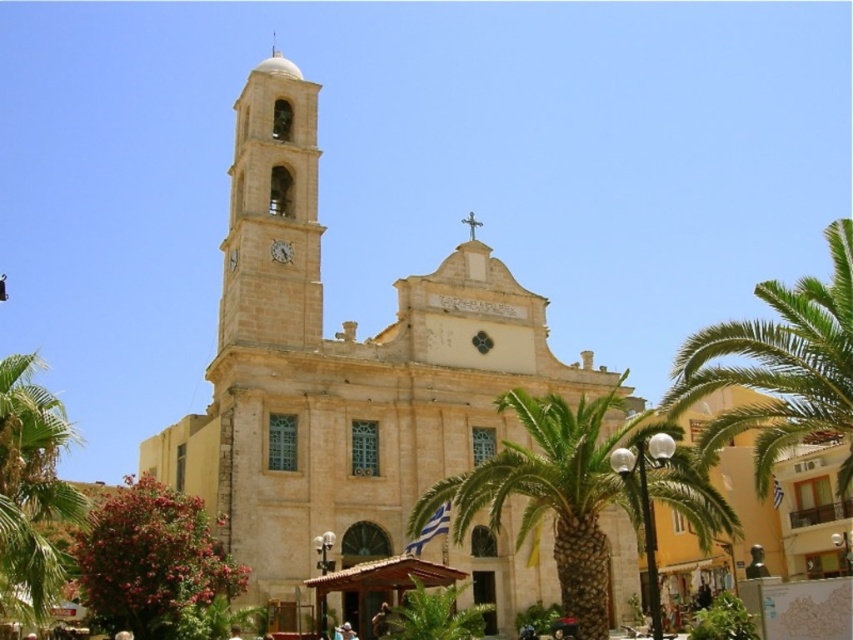
Question: Considering the relative positions of green leafy palm tree at center and green leafy palm tree at right in the image provided, where is green leafy palm tree at center located with respect to green leafy palm tree at right?

Choices:
 (A) above
 (B) below

Answer: (B)

Question: From the image, what is the correct spatial relationship of light beige stone bell tower at upper left in relation to green leafy palm tree at right?

Choices:
 (A) left
 (B) right

Answer: (A)

Question: Estimate the real-world distances between objects in this image. Which object is farther from the green leafy palm tree at center?

Choices:
 (A) light beige stone bell tower at upper left
 (B) green leafy palm tree at left
 (C) green leafy palm tree at right
 (D) beige stone church at center

Answer: (B)

Question: Can you confirm if green leafy palm tree at center is positioned below light beige stone bell tower at upper left?

Choices:
 (A) yes
 (B) no

Answer: (A)

Question: Which object is farther from the camera taking this photo?

Choices:
 (A) green leafy palm tree at left
 (B) green leafy palm tree at center
 (C) green leafy palm tree at right

Answer: (C)

Question: Which object is farther from the camera taking this photo?

Choices:
 (A) green leafy palm tree at center
 (B) green leafy palm tree at left
 (C) beige stone church at center

Answer: (C)